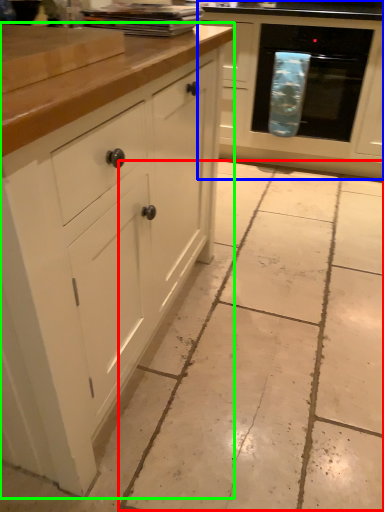
Question: Which is farther away from concrete (highlighted by a red box)? cabinetry (highlighted by a blue box) or cabinetry (highlighted by a green box)?

Choices:
 (A) cabinetry
 (B) cabinetry

Answer: (A)